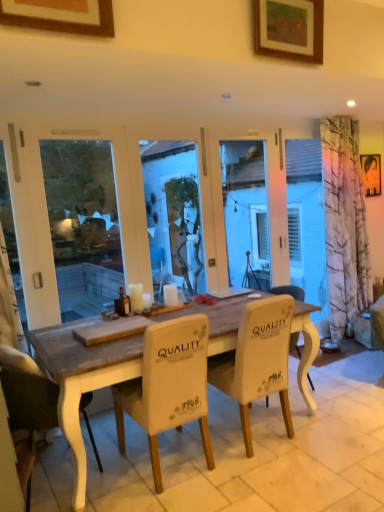
In order to click on vacant space underneath white fabric chair at center, the third chair viewed from the left (from a real-world perspective) in this screenshot , I will do `click(252, 433)`.